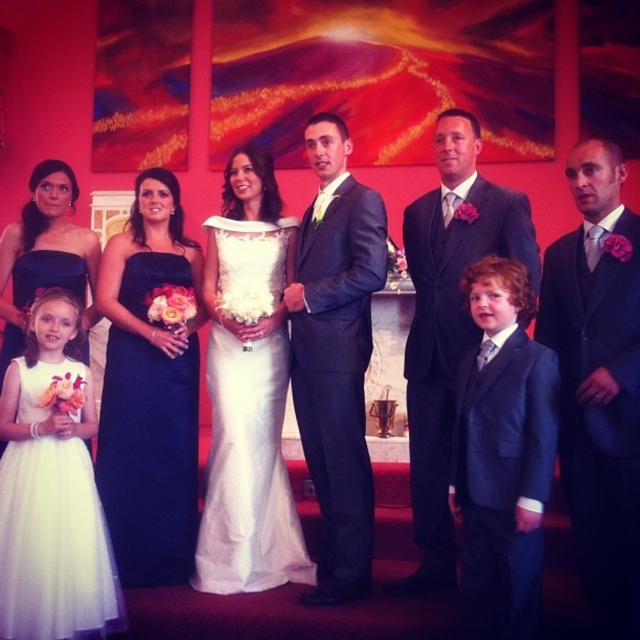
You are a photographer adjusting your camera settings to focus on two specific points in the image. The first point is at coordinates point (634, 225) and the second is at point (93, 602). Which point should you focus on first if you want to ensure the closest object is in sharp focus?

Point (634, 225) is closer to the camera than point (93, 602), so you should focus on point (634, 225) first to ensure the closest object is in sharp focus.

You are standing in the church and want to take a photo of the white satin dress at center. Where should you position your camera to capture the dress in the frame?

To capture the white satin dress at center, position your camera at the coordinates corresponding to the dress location, which is at point [248,470] in the 2D space.

You are a photographer trying to adjust the lighting for the wedding photo. You have two lights to place at the coordinates point (604, 241) and point (275, 500). Which light should be placed closer to the camera to ensure proper exposure?

Point (604, 241) is in front of point (275, 500), so the light at point (604, 241) should be placed closer to the camera to ensure proper exposure.